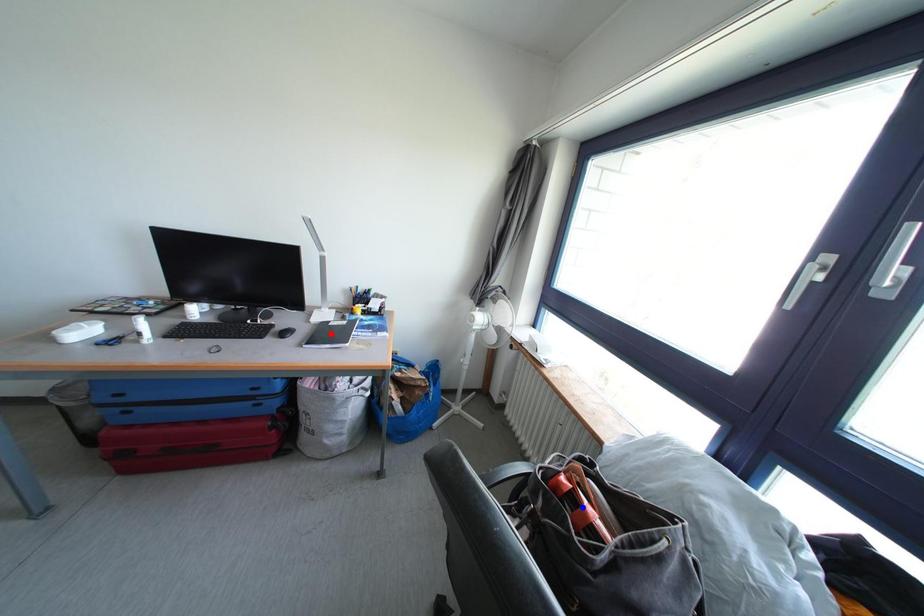
Question: Two points are marked on the image. Which point is closer to the camera?

Choices:
 (A) Blue point is closer.
 (B) Red point is closer.

Answer: (A)